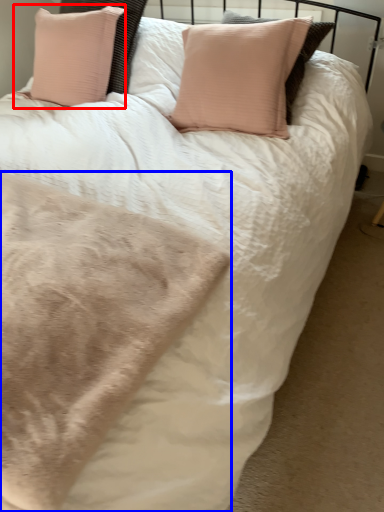
Question: Which point is closer to the camera, pillow (highlighted by a red box) or blanket (highlighted by a blue box)?

Choices:
 (A) pillow
 (B) blanket

Answer: (B)